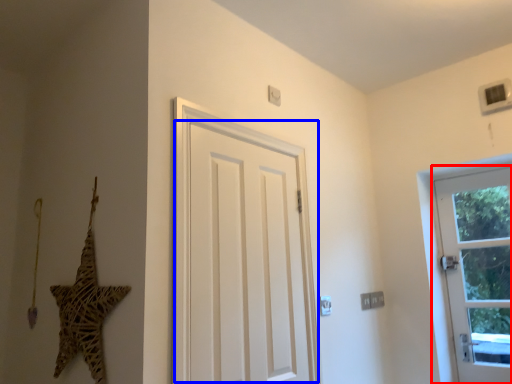
Question: Which object is further to the camera taking this photo, door (highlighted by a red box) or door (highlighted by a blue box)?

Choices:
 (A) door
 (B) door

Answer: (A)